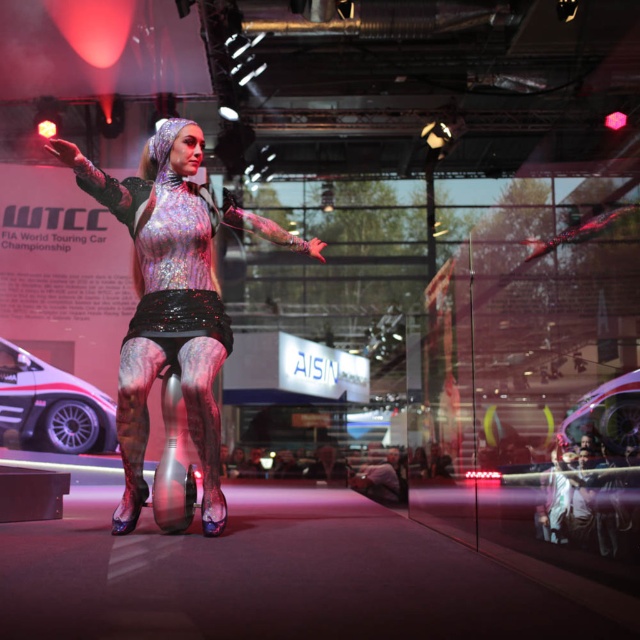
Question: Is shiny metallic bodysuit at center thinner than white glossy car at left?

Choices:
 (A) no
 (B) yes

Answer: (B)

Question: Which point is farther to the camera?

Choices:
 (A) shiny metallic bodysuit at center
 (B) white glossy car at left

Answer: (B)

Question: Can you confirm if shiny metallic bodysuit at center is wider than white glossy car at left?

Choices:
 (A) no
 (B) yes

Answer: (A)

Question: Does shiny metallic bodysuit at center have a lesser width compared to white glossy car at left?

Choices:
 (A) yes
 (B) no

Answer: (A)